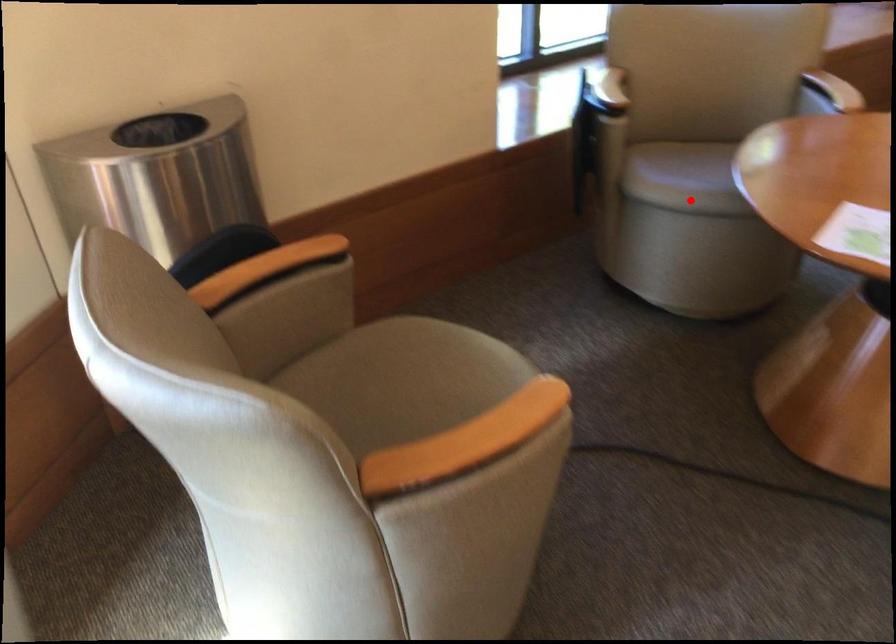
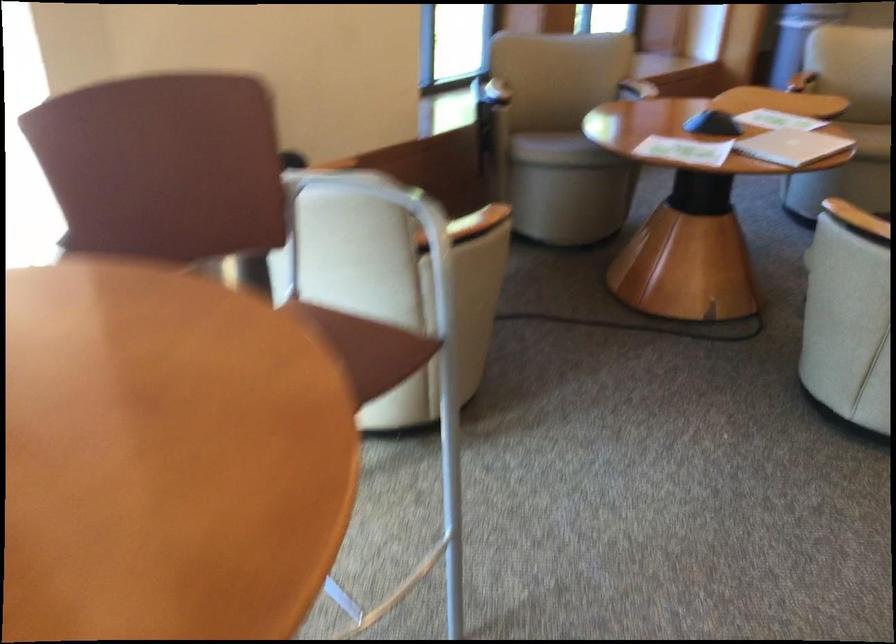
Question: A red point is marked in image1. In image2, is the corresponding 3D point closer to the camera or farther? Reply with the corresponding letter.

Choices:
 (A) The corresponding 3D point is closer.
 (B) The corresponding 3D point is farther.

Answer: (B)